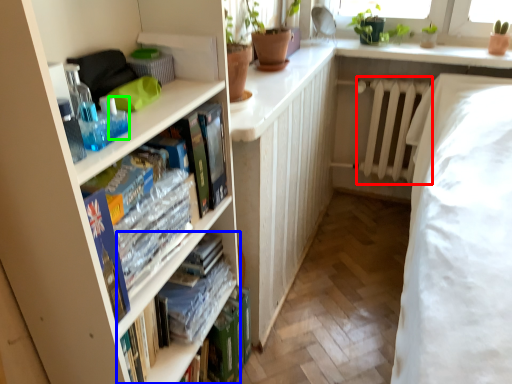
Question: Estimate the real-world distances between objects in this image. Which object is farther from radiator (highlighted by a red box), book (highlighted by a blue box) or toiletry (highlighted by a green box)?

Choices:
 (A) book
 (B) toiletry

Answer: (B)